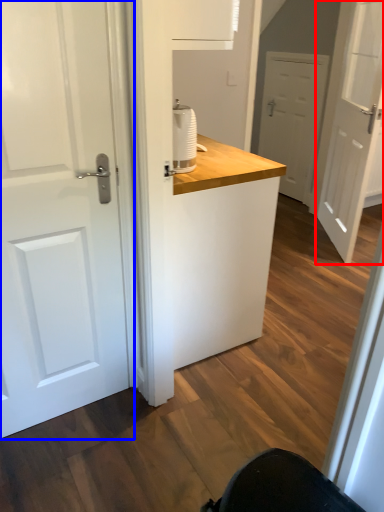
Question: Which object is further to the camera taking this photo, door (highlighted by a red box) or door (highlighted by a blue box)?

Choices:
 (A) door
 (B) door

Answer: (A)